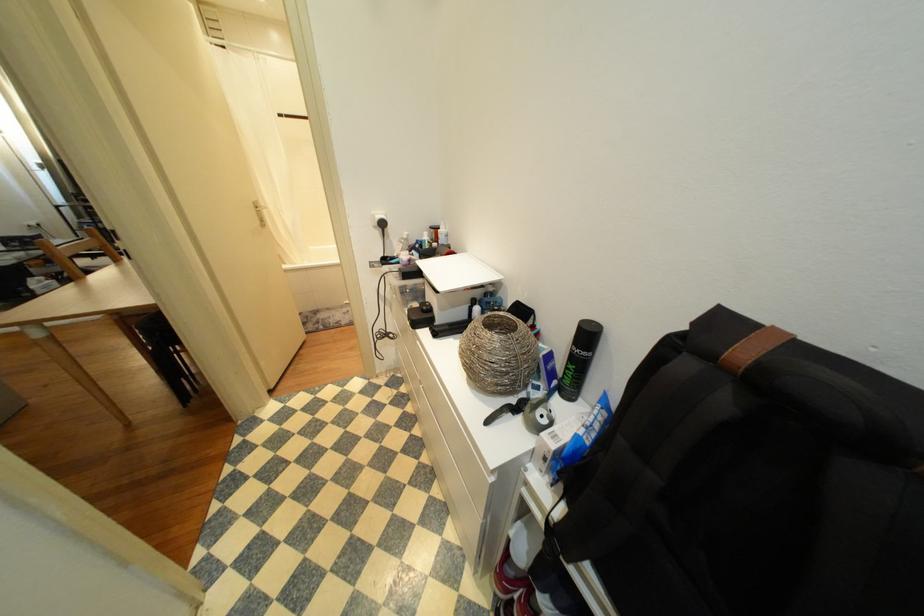
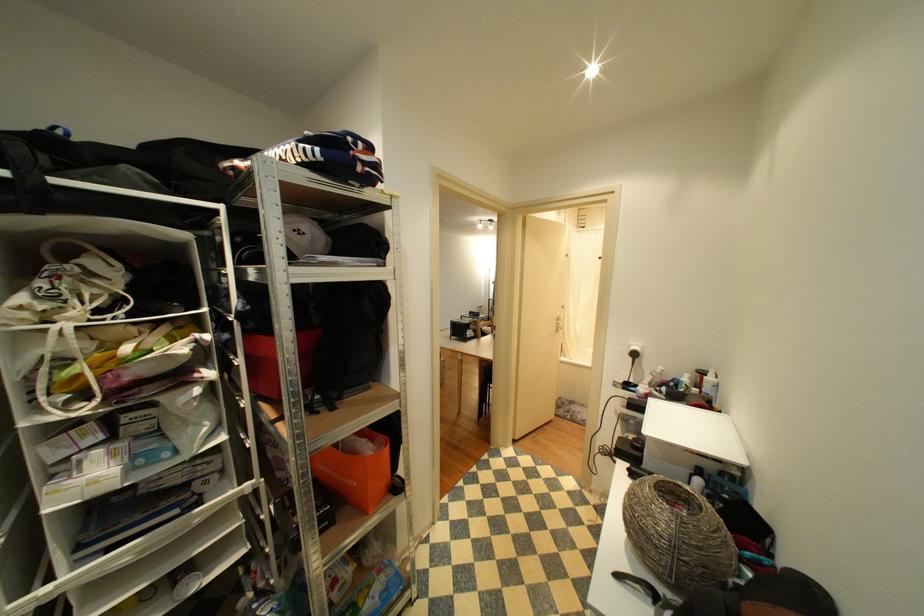
Question: The images are taken continuously from a first-person perspective. In which direction is your viewpoint rotating?

Choices:
 (A) Left
 (B) Right
 (C) Up
 (D) Down

Answer: (A)